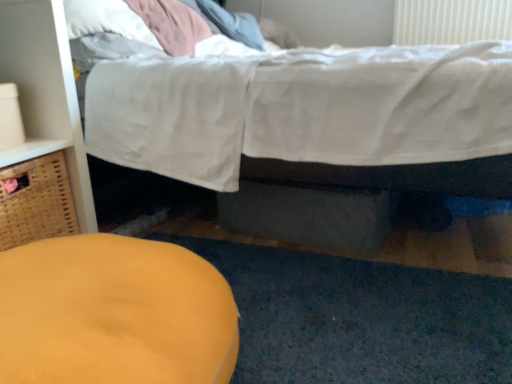
Question: Considering the relative sizes of woven brown basket at left and white cotton bed at upper center in the image provided, is woven brown basket at left taller than white cotton bed at upper center?

Choices:
 (A) no
 (B) yes

Answer: (A)

Question: From a real-world perspective, is woven brown basket at left positioned over white cotton bed at upper center based on gravity?

Choices:
 (A) yes
 (B) no

Answer: (B)

Question: From a real-world perspective, is woven brown basket at left below white cotton bed at upper center?

Choices:
 (A) no
 (B) yes

Answer: (B)

Question: Can you see woven brown basket at left touching white cotton bed at upper center?

Choices:
 (A) no
 (B) yes

Answer: (A)

Question: Considering the relative sizes of woven brown basket at left and white cotton bed at upper center in the image provided, is woven brown basket at left thinner than white cotton bed at upper center?

Choices:
 (A) no
 (B) yes

Answer: (B)

Question: Considering the relative positions of woven brown basket at left and white cotton bed at upper center in the image provided, is woven brown basket at left to the right of white cotton bed at upper center from the viewer's perspective?

Choices:
 (A) no
 (B) yes

Answer: (A)

Question: Can you confirm if white cotton bed at upper center is smaller than woven brown basket at left?

Choices:
 (A) no
 (B) yes

Answer: (A)

Question: From a real-world perspective, is white cotton bed at upper center positioned over woven brown basket at left based on gravity?

Choices:
 (A) no
 (B) yes

Answer: (B)

Question: Can you confirm if white cotton bed at upper center is positioned to the right of woven brown basket at left?

Choices:
 (A) no
 (B) yes

Answer: (B)

Question: Does white cotton bed at upper center contain woven brown basket at left?

Choices:
 (A) yes
 (B) no

Answer: (B)

Question: From the image's perspective, is white cotton bed at upper center under woven brown basket at left?

Choices:
 (A) no
 (B) yes

Answer: (A)

Question: Is white cotton bed at upper center looking in the opposite direction of woven brown basket at left?

Choices:
 (A) yes
 (B) no

Answer: (B)

Question: Considering the relative positions of matte wood dresser at left and matte yellow ottoman at lower left in the image provided, is matte wood dresser at left to the left of matte yellow ottoman at lower left from the viewer's perspective?

Choices:
 (A) no
 (B) yes

Answer: (B)